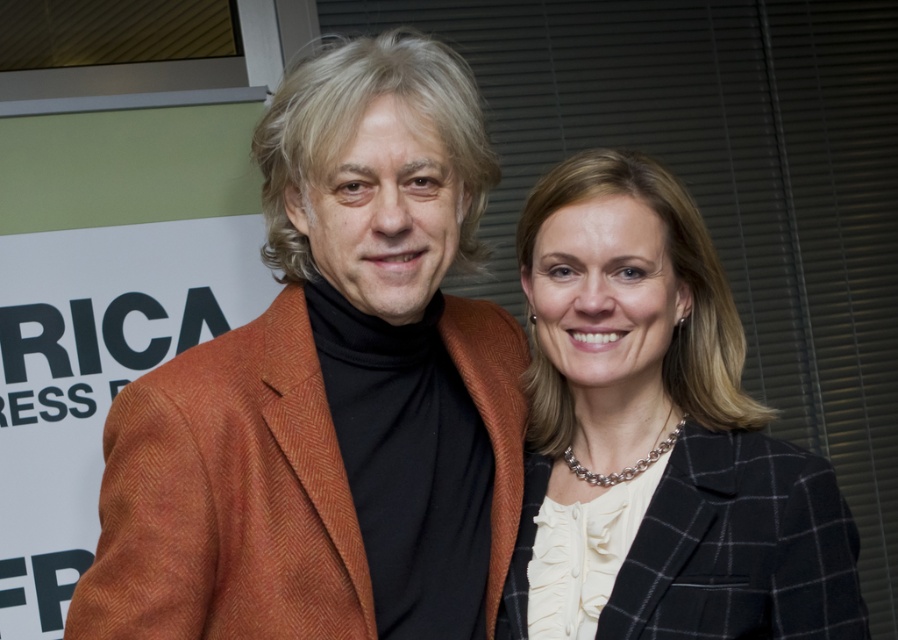
Is point (449, 550) positioned after point (692, 532)?

Yes, point (449, 550) is behind point (692, 532).

Who is positioned more to the right, orange herringbone blazer at center or black textured blazer at center?

black textured blazer at center is more to the right.

Is point (458, 424) in front of point (583, 273)?

No, it is not.

At what (x,y) coordinates should I click in order to perform the action: click on orange herringbone blazer at center. Please return your answer as a coordinate pair (x, y). This screenshot has width=898, height=640. Looking at the image, I should click on (331, 390).